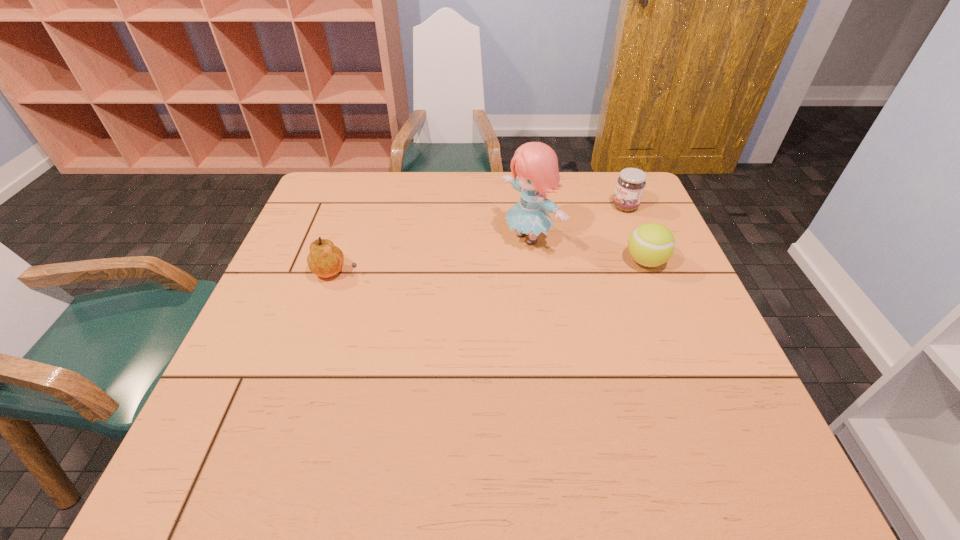
The image size is (960, 540). I want to click on unoccupied area between the second object from left to right and the tennis ball, so click(x=588, y=249).

This screenshot has height=540, width=960. What are the coordinates of `vacant point located between the pear and the jam` in the screenshot? It's located at (481, 240).

Where is `vacant area between the pear and the tennis ball`? The width and height of the screenshot is (960, 540). vacant area between the pear and the tennis ball is located at coordinates (492, 267).

The height and width of the screenshot is (540, 960). I want to click on unoccupied area between the tallest object and the tennis ball, so click(x=588, y=249).

Select which object appears as the closest to the tennis ball. Please provide its 2D coordinates. Your answer should be formatted as a tuple, i.e. [(x, y)], where the tuple contains the x and y coordinates of a point satisfying the conditions above.

[(630, 185)]

The width and height of the screenshot is (960, 540). I want to click on object that is the second nearest to the farthest object, so click(x=536, y=164).

Where is `vacant space that satisfies the following two spatial constraints: 1. on the back side of the third object from right to left; 2. on the right side of the farthest object`? The image size is (960, 540). vacant space that satisfies the following two spatial constraints: 1. on the back side of the third object from right to left; 2. on the right side of the farthest object is located at coordinates (526, 207).

Locate an element on the screen. Image resolution: width=960 pixels, height=540 pixels. free spot that satisfies the following two spatial constraints: 1. on the back side of the tennis ball; 2. on the left side of the leftmost object is located at coordinates (341, 261).

You are a GUI agent. You are given a task and a screenshot of the screen. Output one action in this format:
    pyautogui.click(x=<x>, y=<y>)
    Task: Click on the vacant position in the image that satisfies the following two spatial constraints: 1. on the back side of the leftmost object; 2. on the right side of the jam
    This screenshot has width=960, height=540.
    Given the screenshot: What is the action you would take?
    pyautogui.click(x=359, y=207)

Where is `free location that satisfies the following two spatial constraints: 1. on the front side of the tennis ball; 2. on the left side of the doll`? free location that satisfies the following two spatial constraints: 1. on the front side of the tennis ball; 2. on the left side of the doll is located at coordinates coord(533,261).